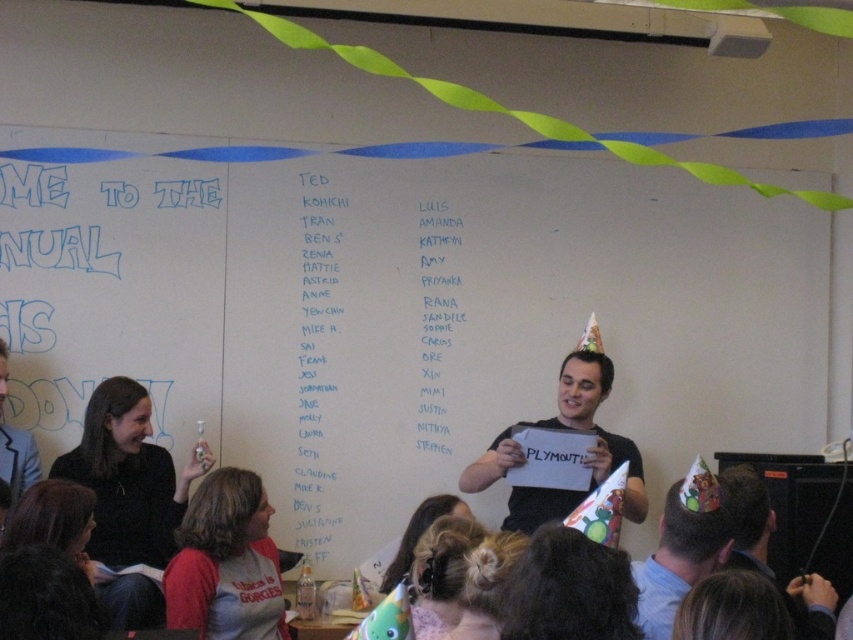
Question: Does white paper list at center come behind black paper at center?

Choices:
 (A) yes
 (B) no

Answer: (B)

Question: Which object is positioned closest to the white matte board at center?

Choices:
 (A) black fabric shirt at lower left
 (B) dark brown hair at lower center

Answer: (A)

Question: Which point appears farthest from the camera in this image?

Choices:
 (A) (746, 529)
 (B) (416, 532)
 (C) (218, 632)

Answer: (B)

Question: Considering the real-world distances, which object is farthest from the matte black party hat at lower right?

Choices:
 (A) white matte board at center
 (B) black fabric shirt at lower left
 (C) white paper hat at center
 (D) matte red shirt at lower left

Answer: (B)

Question: Can you confirm if white matte board at center is positioned to the right of black paper at center?

Choices:
 (A) no
 (B) yes

Answer: (A)

Question: Can you confirm if matte red shirt at lower left is positioned to the right of dark brown hair at lower center?

Choices:
 (A) yes
 (B) no

Answer: (B)